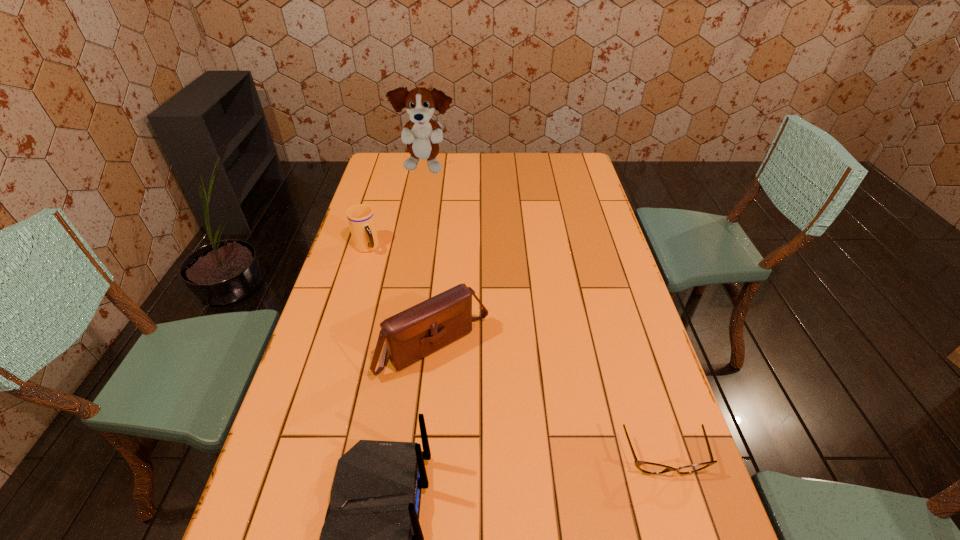
Identify the location of vacant space that's between the shortest object and the farthest object. (544, 313).

Where is `free space between the spectacles and the third nearest object`? The image size is (960, 540). free space between the spectacles and the third nearest object is located at coordinates (549, 402).

Identify which object is the closest to the second farthest object. Please provide its 2D coordinates. Your answer should be formatted as a tuple, i.e. [(x, y)], where the tuple contains the x and y coordinates of a point satisfying the conditions above.

[(413, 334)]

Image resolution: width=960 pixels, height=540 pixels. I want to click on object that ranks as the second closest to the shoulder bag, so click(x=361, y=220).

Locate an element on the screen. vacant area in the image that satisfies the following two spatial constraints: 1. on the front side of the tallest object; 2. on the right side of the third farthest object is located at coordinates (395, 347).